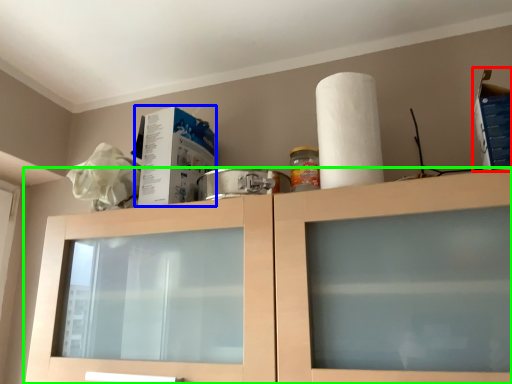
Question: Based on their relative distances, which object is farther from box (highlighted by a red box)? Choose from box (highlighted by a blue box) and cabinetry (highlighted by a green box).

Choices:
 (A) box
 (B) cabinetry

Answer: (A)